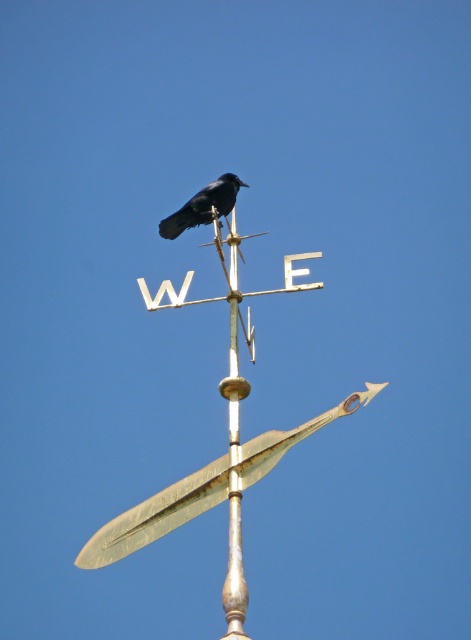
Question: Does gold polished metal spire at center appear under black matte bird at center?

Choices:
 (A) no
 (B) yes

Answer: (B)

Question: Is polished brass pole at center to the right of black matte bird at center from the viewer's perspective?

Choices:
 (A) yes
 (B) no

Answer: (A)

Question: In this image, where is gold polished metal spire at center located relative to polished brass pole at center?

Choices:
 (A) right
 (B) left

Answer: (B)

Question: Which point is farther from the camera taking this photo?

Choices:
 (A) (123, 534)
 (B) (233, 372)
 (C) (235, 182)

Answer: (C)

Question: Among these objects, which one is nearest to the camera?

Choices:
 (A) black matte bird at center
 (B) polished brass pole at center

Answer: (B)

Question: Among these objects, which one is nearest to the camera?

Choices:
 (A) gold polished metal spire at center
 (B) polished brass pole at center
 (C) black matte bird at center

Answer: (A)